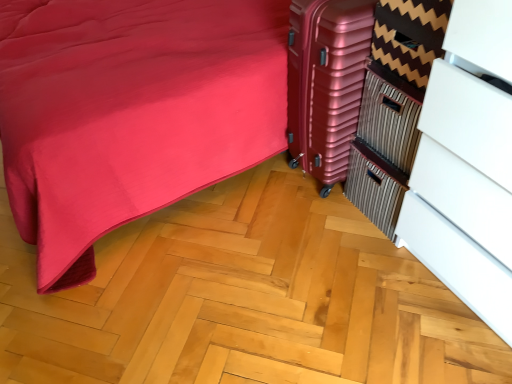
What do you see at coordinates (326, 83) in the screenshot? I see `metallic pink suitcase at center-right` at bounding box center [326, 83].

Locate an element on the screen. This screenshot has width=512, height=384. metallic pink suitcase at center-right is located at coordinates (326, 83).

Image resolution: width=512 pixels, height=384 pixels. Describe the element at coordinates (467, 165) in the screenshot. I see `white glossy dresser at right` at that location.

At what (x,y) coordinates should I click in order to perform the action: click on white glossy dresser at right. Please return your answer as a coordinate pair (x, y). Image resolution: width=512 pixels, height=384 pixels. Looking at the image, I should click on (467, 165).

In order to face white glossy dresser at right, should I rotate leftwards or rightwards?

You should look right and rotate roughly 34.080 degrees.

Locate an element on the screen. The image size is (512, 384). metallic pink suitcase at center-right is located at coordinates (326, 83).

Considering the positions of objects metallic pink suitcase at center-right and white glossy dresser at right in the image provided, who is more to the left, metallic pink suitcase at center-right or white glossy dresser at right?

From the viewer's perspective, metallic pink suitcase at center-right appears more on the left side.

Which is in front, metallic pink suitcase at center-right or white glossy dresser at right?

white glossy dresser at right.

Does point (320, 146) come behind point (508, 97)?

Yes, it is.

From the image's perspective, is metallic pink suitcase at center-right below white glossy dresser at right?

No.

From a real-world perspective, is metallic pink suitcase at center-right physically located above or below white glossy dresser at right?

From a real-world perspective, metallic pink suitcase at center-right is physically below white glossy dresser at right.

Can you confirm if metallic pink suitcase at center-right is wider than white glossy dresser at right?

Correct, the width of metallic pink suitcase at center-right exceeds that of white glossy dresser at right.

Can you confirm if metallic pink suitcase at center-right is taller than white glossy dresser at right?

No, metallic pink suitcase at center-right is not taller than white glossy dresser at right.

Can you confirm if metallic pink suitcase at center-right is smaller than white glossy dresser at right?

Yes, metallic pink suitcase at center-right is smaller than white glossy dresser at right.

Would you say metallic pink suitcase at center-right is outside white glossy dresser at right?

Yes.

Can you see metallic pink suitcase at center-right touching white glossy dresser at right?

No.

Is metallic pink suitcase at center-right aimed at white glossy dresser at right?

No.

From the picture: What's the angular difference between metallic pink suitcase at center-right and white glossy dresser at right's facing directions?

The angular difference between metallic pink suitcase at center-right and white glossy dresser at right is 0.0296 degrees.

Measure the distance between metallic pink suitcase at center-right and white glossy dresser at right.

metallic pink suitcase at center-right and white glossy dresser at right are 17.82 inches apart from each other.

I want to click on luggage behind the white glossy dresser at right, so click(326, 83).

Between white glossy dresser at right and metallic pink suitcase at center-right, which one appears on the right side from the viewer's perspective?

white glossy dresser at right is more to the right.

Which object is closer to the camera, white glossy dresser at right or metallic pink suitcase at center-right?

white glossy dresser at right is closer to the camera.

Is point (464, 239) in front of point (369, 1)?

That is True.

From the image's perspective, is white glossy dresser at right located beneath metallic pink suitcase at center-right?

Correct, white glossy dresser at right appears lower than metallic pink suitcase at center-right in the image.

From a real-world perspective, relative to metallic pink suitcase at center-right, is white glossy dresser at right vertically above or below?

white glossy dresser at right is situated higher than metallic pink suitcase at center-right in the real world.

Between white glossy dresser at right and metallic pink suitcase at center-right, which one has larger width?

metallic pink suitcase at center-right.

Who is shorter, white glossy dresser at right or metallic pink suitcase at center-right?

With less height is metallic pink suitcase at center-right.

Can you confirm if white glossy dresser at right is bigger than metallic pink suitcase at center-right?

Yes, white glossy dresser at right is bigger than metallic pink suitcase at center-right.

Is white glossy dresser at right located outside metallic pink suitcase at center-right?

Yes, white glossy dresser at right is outside of metallic pink suitcase at center-right.

Would you say white glossy dresser at right is a long distance from metallic pink suitcase at center-right?

No, there isn't a large distance between white glossy dresser at right and metallic pink suitcase at center-right.

Is white glossy dresser at right turned away from metallic pink suitcase at center-right?

No, white glossy dresser at right is not facing the opposite direction of metallic pink suitcase at center-right.

Find the location of `luggage that appears on the left of white glossy dresser at right`. luggage that appears on the left of white glossy dresser at right is located at coordinates (326, 83).

This screenshot has height=384, width=512. Find the location of `dresser above the metallic pink suitcase at center-right (from a real-world perspective)`. dresser above the metallic pink suitcase at center-right (from a real-world perspective) is located at coordinates (467, 165).

Identify the location of dresser on the right of metallic pink suitcase at center-right. (467, 165).